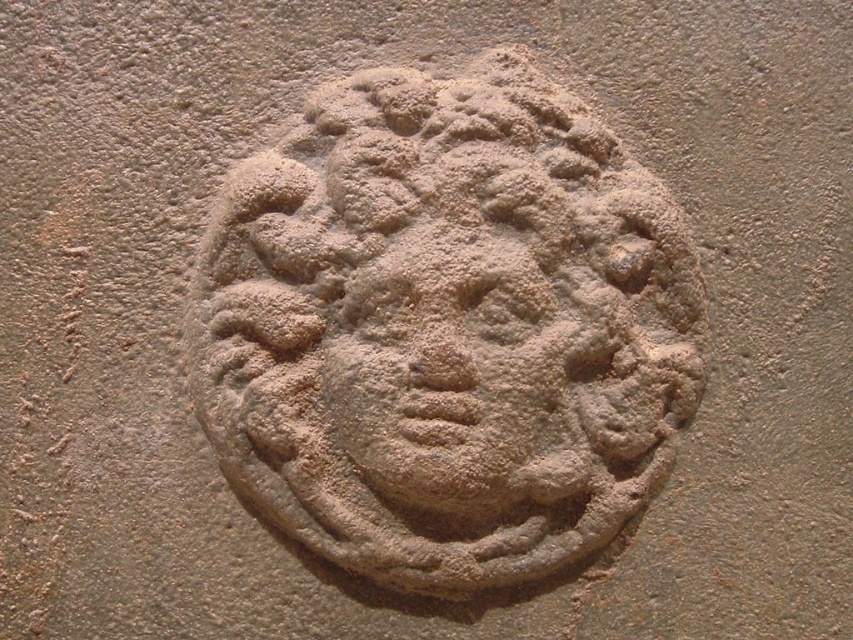
Consider the image. You are an archaeologist examining the ancient relief sculpture. You notice two faces depicted here. Which one, the matte sandstone face at center or the matte stone face at center, could potentially have a broader width according to the description?

The matte sandstone face at center might be wider than the matte stone face at center, so it could potentially have a broader width.

Based on the photo, you are an archaeologist examining the ancient relief sculpture. You notice two faces carved into the stone. Which face, the matte sandstone face at center or the matte stone face at center, is positioned closer to you?

The matte sandstone face at center is positioned closer to you because the matte stone face at center is behind it.